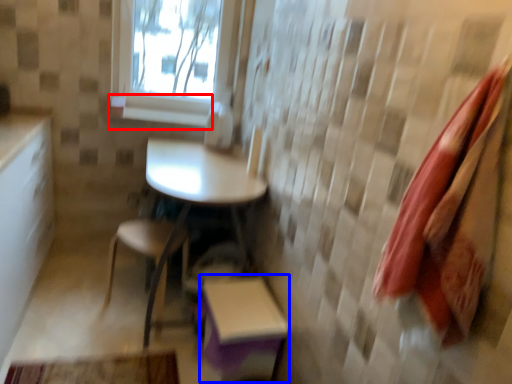
Question: Among these objects, which one is farthest to the camera, window sill (highlighted by a red box) or step stool (highlighted by a blue box)?

Choices:
 (A) window sill
 (B) step stool

Answer: (A)